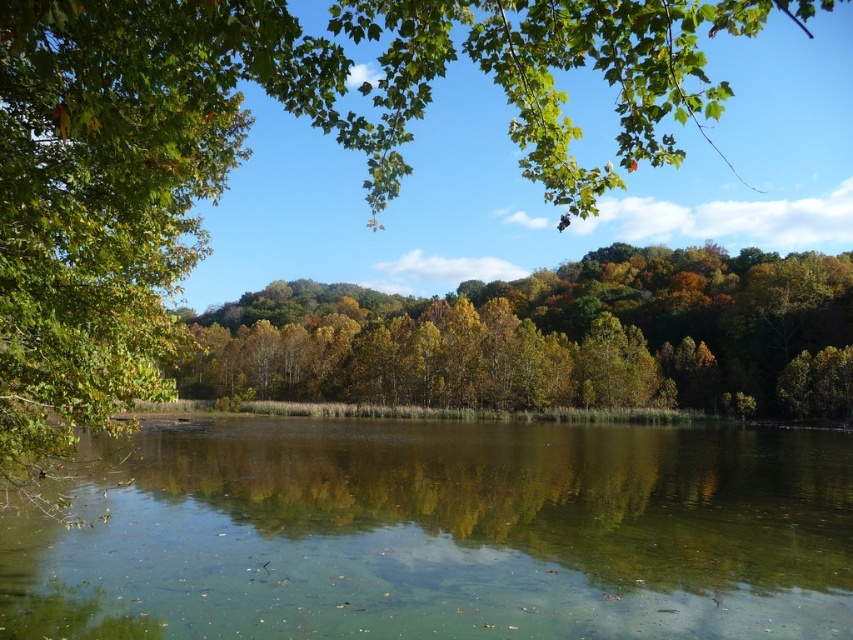
Can you confirm if green translucent water at center is positioned to the right of green leafy trees at center?

Yes, green translucent water at center is to the right of green leafy trees at center.

Does green translucent water at center appear on the left side of green leafy trees at center?

Incorrect, green translucent water at center is not on the left side of green leafy trees at center.

Where is `green translucent water at center`? green translucent water at center is located at coordinates (445, 534).